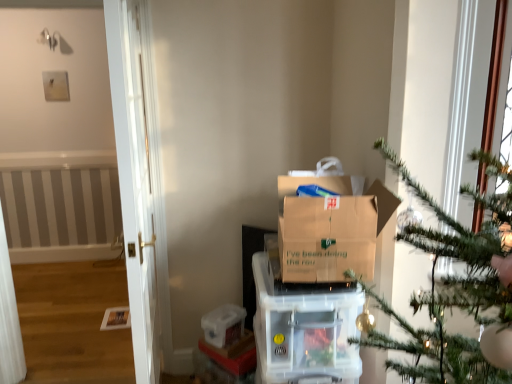
Question: Is brown cardboard box at center turned away from transparent plastic container at lower center?

Choices:
 (A) yes
 (B) no

Answer: (B)

Question: Would you say transparent plastic container at lower center is part of brown cardboard box at center's contents?

Choices:
 (A) yes
 (B) no

Answer: (B)

Question: Does brown cardboard box at center touch transparent plastic container at lower center?

Choices:
 (A) yes
 (B) no

Answer: (B)

Question: Is brown cardboard box at center in front of transparent plastic container at lower center?

Choices:
 (A) no
 (B) yes

Answer: (B)

Question: From a real-world perspective, is brown cardboard box at center below transparent plastic container at lower center?

Choices:
 (A) yes
 (B) no

Answer: (B)

Question: Considering the relative sizes of brown cardboard box at center and transparent plastic container at lower center in the image provided, is brown cardboard box at center smaller than transparent plastic container at lower center?

Choices:
 (A) no
 (B) yes

Answer: (A)

Question: Is clear plastic storage container at center not near transparent plastic container at lower center?

Choices:
 (A) yes
 (B) no

Answer: (B)

Question: Is clear plastic storage container at center oriented towards transparent plastic container at lower center?

Choices:
 (A) no
 (B) yes

Answer: (A)

Question: Does clear plastic storage container at center touch transparent plastic container at lower center?

Choices:
 (A) no
 (B) yes

Answer: (A)

Question: From a real-world perspective, is clear plastic storage container at center beneath transparent plastic container at lower center?

Choices:
 (A) no
 (B) yes

Answer: (A)

Question: Is clear plastic storage container at center positioned before transparent plastic container at lower center?

Choices:
 (A) no
 (B) yes

Answer: (B)

Question: Considering the relative sizes of clear plastic storage container at center and transparent plastic container at lower center in the image provided, is clear plastic storage container at center bigger than transparent plastic container at lower center?

Choices:
 (A) no
 (B) yes

Answer: (B)

Question: From a real-world perspective, is transparent plastic container at lower center on top of brown cardboard box at center?

Choices:
 (A) yes
 (B) no

Answer: (B)